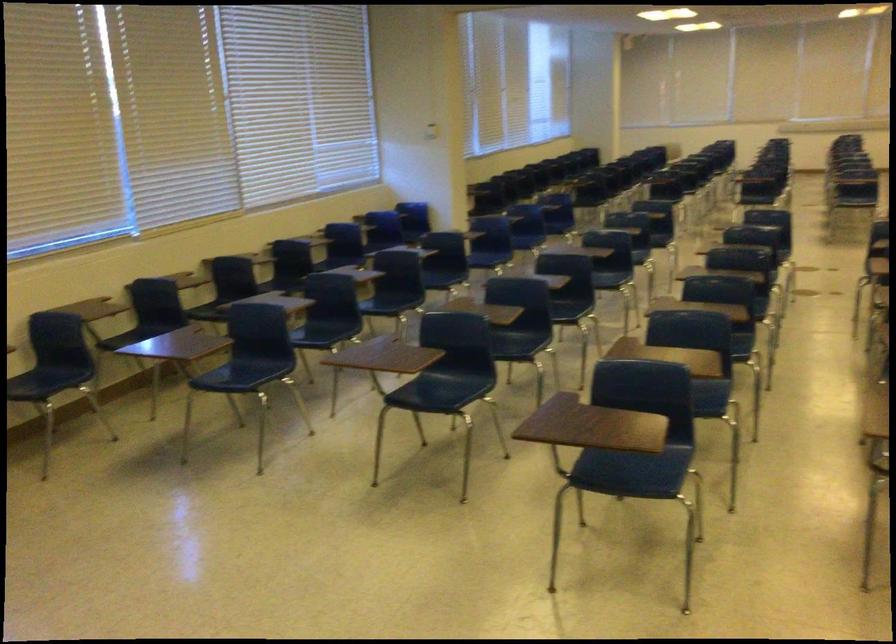
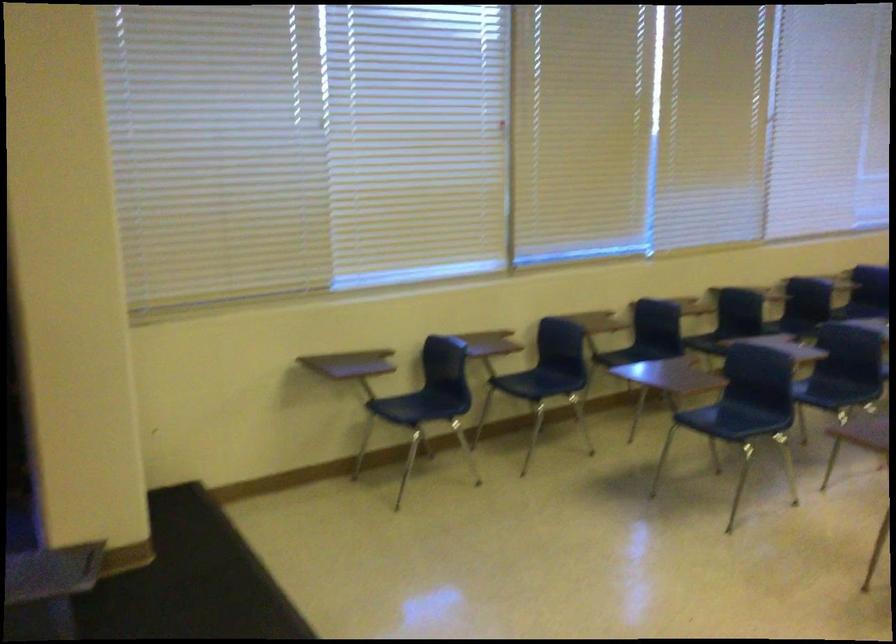
Locate, in the second image, the point that corresponds to point 225,91 in the first image.

(771, 116)